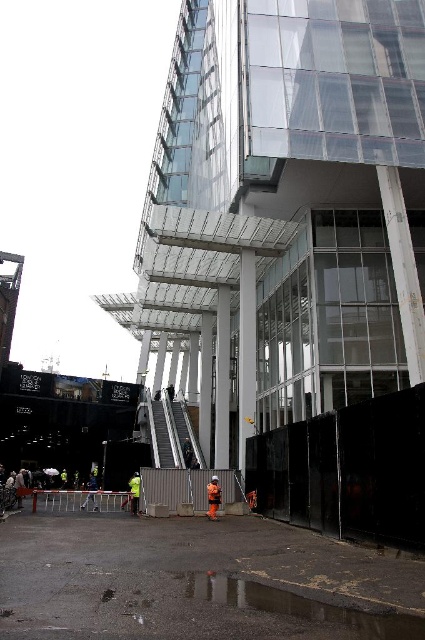
You are a pedestrian trying to navigate through the construction zone in front of the modern glass building. You see the metallic gray barricade at lower center and the metal barricade at lower center. Which barricade is located to the right of the other?

The metallic gray barricade at lower center is positioned on the right side of the metal barricade at lower center.

You are a pedestrian approaching the construction site in front of the modern glass building. You see a metal barricade at lower center and an orange reflective vest at center. Which object is positioned more to the left side of the scene?

The metal barricade at lower center is positioned more to the left side of the scene compared to the orange reflective vest at center.